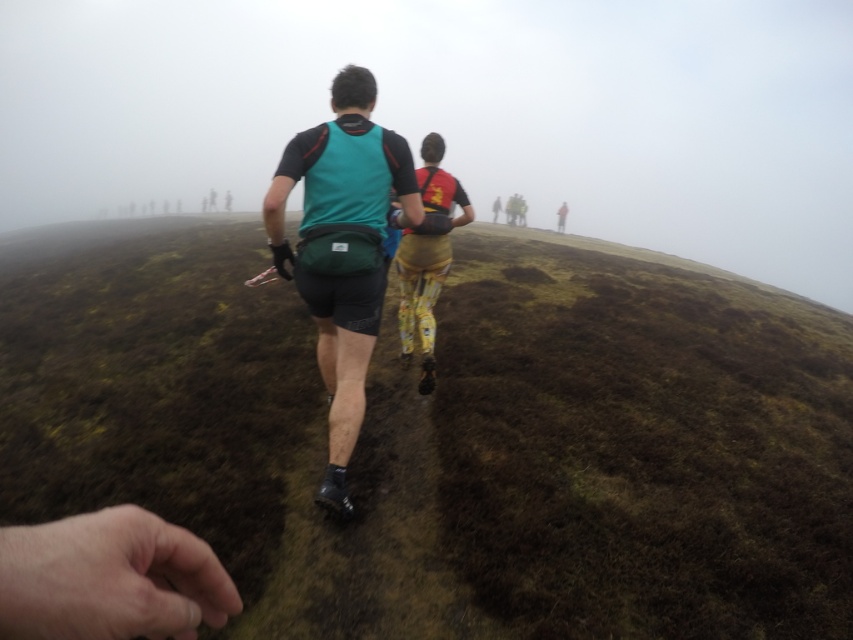
You are a hiker following the two individuals on the path. You want to reach the point marked by the coordinates at the end of the trail. Which coordinate point should you aim for first, point (704,625) or point (428,323)?

You should aim for point (428,323) first because point (704,625) is in front of it, meaning point (428,323) is closer to your current position.

You are a hiker who wants to take a photo of the teal fabric backpack at center. You have a camera that requires you to be at least 10 feet away to avoid blurring the image. Are you able to take a clear photo from where the camera is currently positioned?

The teal fabric backpack at center and camera are 8.62 feet apart from each other. Since the minimum required distance is 10 feet, the camera is too close to capture a clear photo without blurring.

You are a hiker who wants to place your teal fabric backpack at center on the ground. Is there enough space for it on the dark brown mossy ground at center?

The dark brown mossy ground at center is taller than the teal fabric backpack at center, so there is enough space to place the teal fabric backpack at center on the ground.